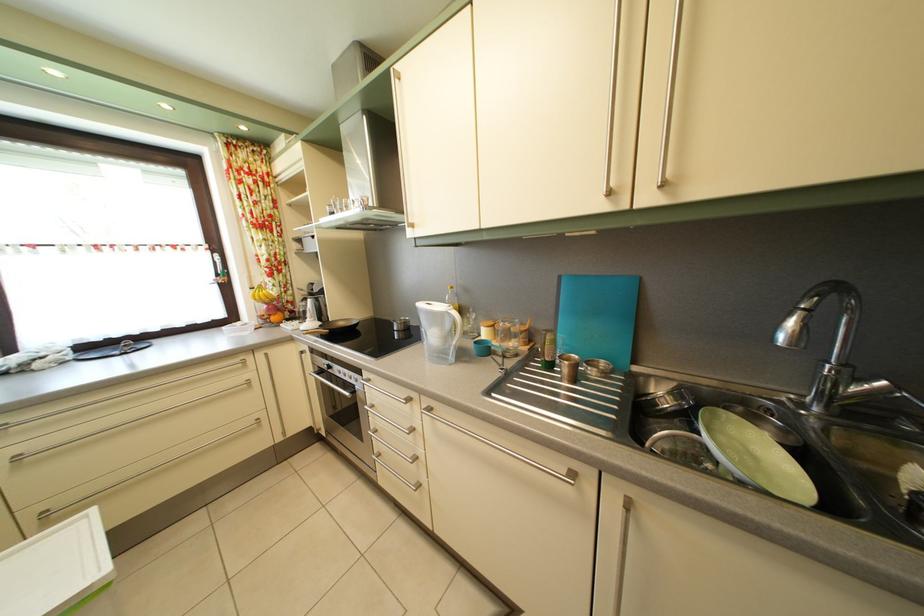
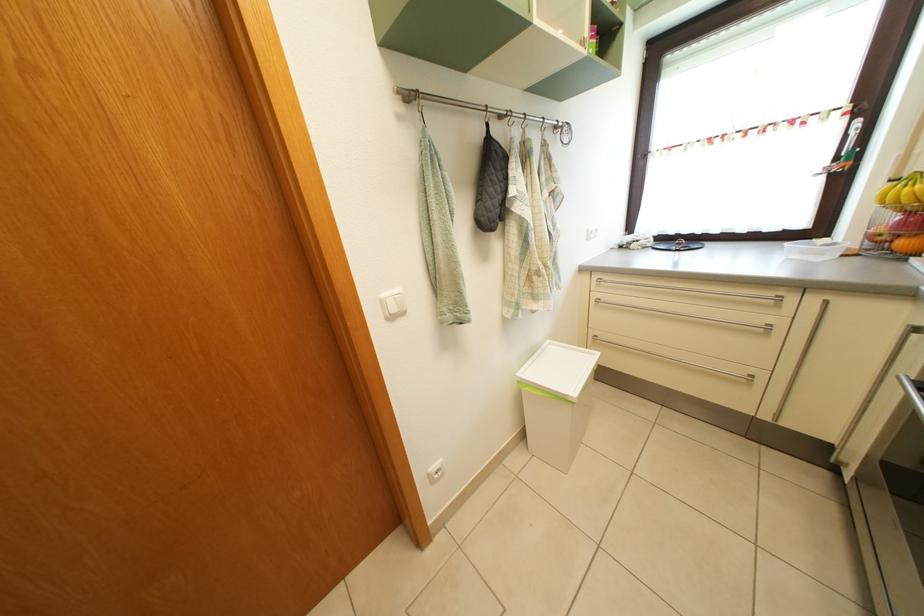
First-person continuous shooting, in which direction is the camera rotating?

The camera rotated toward left-down.